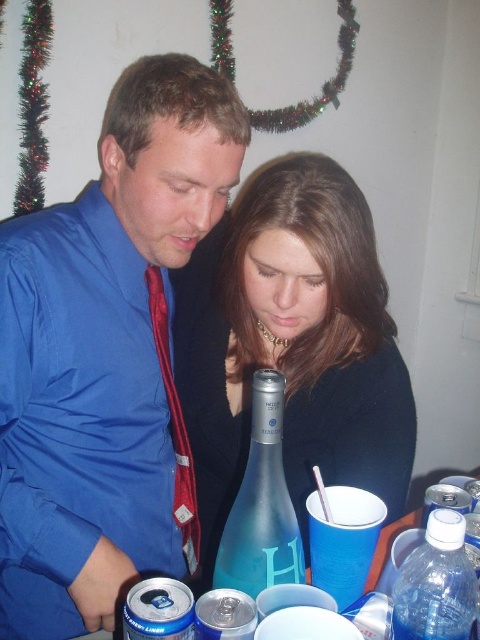
This screenshot has height=640, width=480. What do you see at coordinates (107, 356) in the screenshot? I see `blue satin shirt at center` at bounding box center [107, 356].

Can you confirm if blue satin shirt at center is smaller than matte blue glass bottle at center?

Yes, blue satin shirt at center is smaller than matte blue glass bottle at center.

Measure the distance between blue satin shirt at center and camera.

blue satin shirt at center is 29.46 inches from camera.

Where is `blue satin shirt at center`? This screenshot has width=480, height=640. blue satin shirt at center is located at coordinates (107, 356).

I want to click on matte blue glass bottle at center, so 291,342.

Can you confirm if matte blue glass bottle at center is thinner than translucent plastic water bottle at lower right?

No.

Find the location of a particular element. The height and width of the screenshot is (640, 480). matte blue glass bottle at center is located at coordinates (291, 342).

Where is `matte blue glass bottle at center`? matte blue glass bottle at center is located at coordinates click(x=291, y=342).

Is blue glass bottle at center behind translucent plastic water bottle at lower right?

Yes.

Which is behind, point (291, 579) or point (432, 570)?

The point (291, 579) is behind.

Locate an element on the screen. blue glass bottle at center is located at coordinates (262, 504).